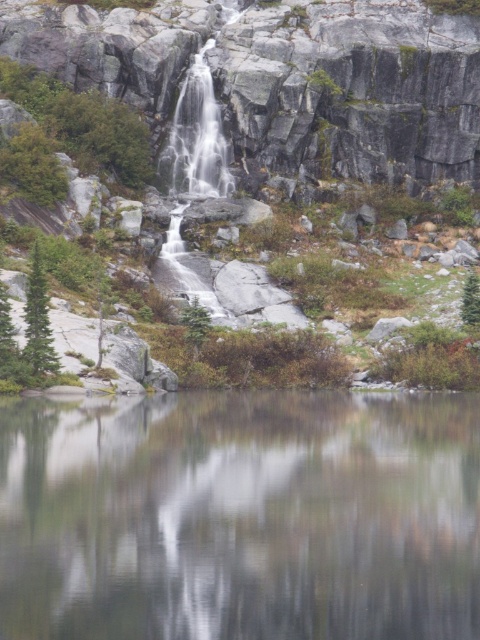
Question: Does gray rock wall at upper center have a greater width compared to green matte tree at center?

Choices:
 (A) no
 (B) yes

Answer: (B)

Question: Which of the following is the farthest from the observer?

Choices:
 (A) green matte tree at center
 (B) smooth reflective water at center
 (C) green matte tree at left
 (D) gray rock wall at upper center

Answer: (A)

Question: Considering the relative positions of gray rock wall at upper center and green matte tree at left in the image provided, where is gray rock wall at upper center located with respect to green matte tree at left?

Choices:
 (A) above
 (B) below

Answer: (A)

Question: Is smooth reflective water at center below green matte tree at center?

Choices:
 (A) yes
 (B) no

Answer: (A)

Question: Which object is positioned farthest from the green matte tree at center?

Choices:
 (A) green matte tree at left
 (B) smooth reflective water at center
 (C) gray rock wall at upper center

Answer: (B)

Question: Which point is farther to the camera?

Choices:
 (A) smooth reflective water at center
 (B) gray rock wall at upper center
 (C) green matte tree at left

Answer: (B)